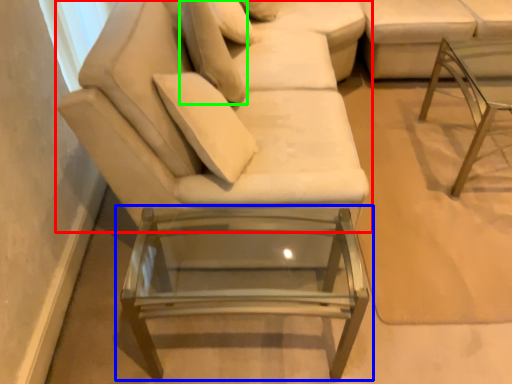
Question: Considering the real-world distances, which object is closest to studio couch (highlighted by a red box)? table (highlighted by a blue box) or pillow (highlighted by a green box).

Choices:
 (A) table
 (B) pillow

Answer: (B)